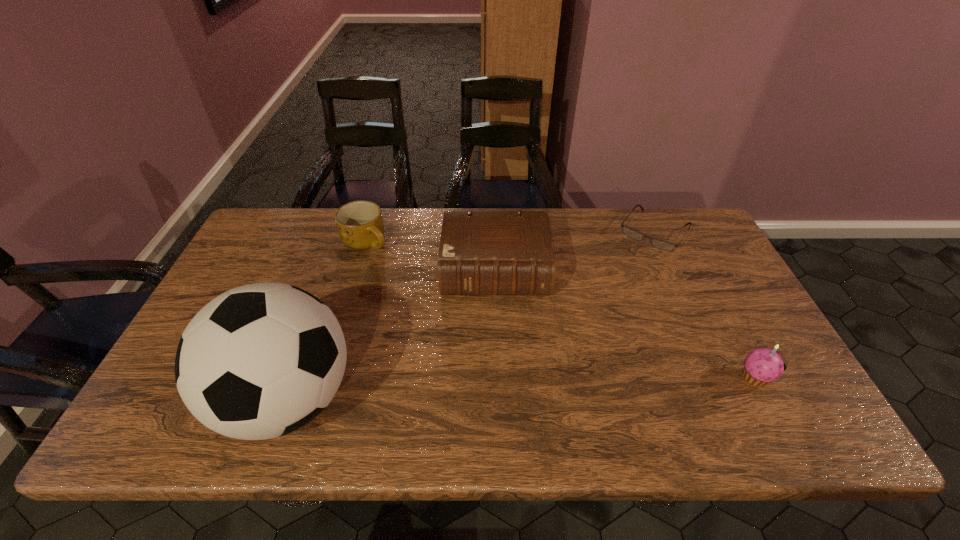
Where is `object present at the left edge`? The image size is (960, 540). object present at the left edge is located at coordinates (259, 361).

Where is `cupcake that is at the right edge`? cupcake that is at the right edge is located at coordinates pyautogui.click(x=762, y=365).

Identify the location of spectacles at the right edge. This screenshot has height=540, width=960. (659, 244).

Find the location of `object at the near left corner`. object at the near left corner is located at coordinates (259, 361).

The height and width of the screenshot is (540, 960). What are the coordinates of `object present at the far right corner` in the screenshot? It's located at (659, 244).

Locate an element on the screen. object positioned at the near right corner is located at coordinates (762, 365).

You are a GUI agent. You are given a task and a screenshot of the screen. Output one action in this format:
    pyautogui.click(x=<x>, y=<y>)
    Task: Click on the free space at the far edge of the desktop
    
    Given the screenshot: What is the action you would take?
    pyautogui.click(x=576, y=249)

In the image, there is a desktop. Where is `vacant space at the near edge`? This screenshot has height=540, width=960. vacant space at the near edge is located at coordinates (610, 382).

Identify the location of vacant area at the right edge. (691, 307).

In the image, there is a desktop. Where is `vacant region at the far left corner`? vacant region at the far left corner is located at coordinates (262, 226).